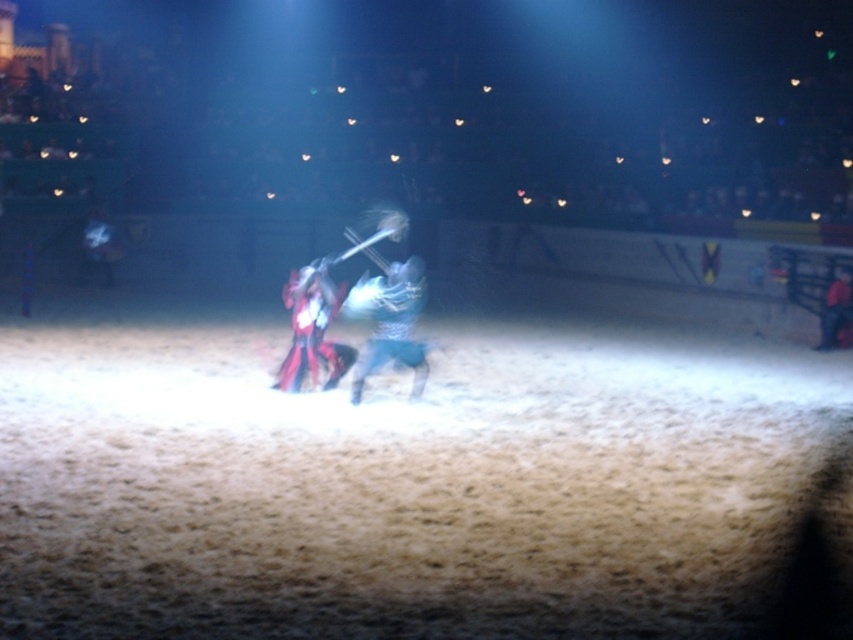
You are an archer positioned at the center of the arena. You notice a target marked by a point at coordinates point (x=389, y=321). What object is located at that point?

The point (x=389, y=321) corresponds to metallic blue armor at center.

You are a knight in the arena and need to reach the point marked at coordinates point (363, 300) to retrieve a hidden item. Your horse can gallop up to 12 meters per second. How long will it take you to reach the point from your current position?

The distance of point (363, 300) from the camera is 11.21 meters. Since your horse can gallop at 12 meters per second, it will take approximately 0.93 seconds to reach the point.

You are a knight in the arena and must choose between the metallic blue armor at center and the shiny red armor at center. Which armor is closer to the right side of the arena?

The metallic blue armor at center is positioned on the right side of shiny red armor at center, so it is closer to the right side of the arena.